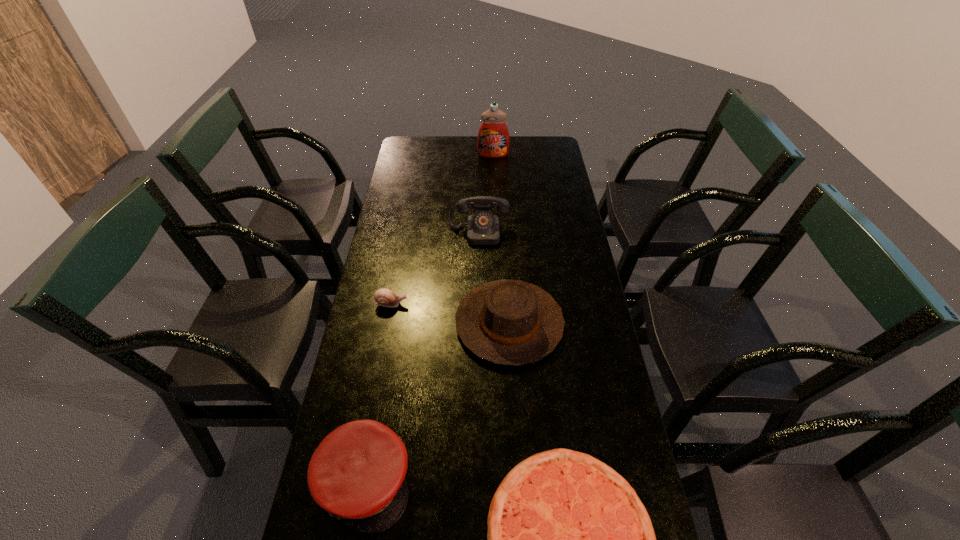
Where is `detergent`? The height and width of the screenshot is (540, 960). detergent is located at coordinates (493, 137).

The image size is (960, 540). I want to click on the farthest object, so click(x=493, y=137).

Find the location of a particular element. This screenshot has width=960, height=540. telephone is located at coordinates (483, 228).

I want to click on cowboy hat, so click(506, 322).

Image resolution: width=960 pixels, height=540 pixels. I want to click on cap, so click(x=357, y=472).

At what (x,y) coordinates should I click in order to perform the action: click on the fifth tallest object. Please return your answer as a coordinate pair (x, y). The height and width of the screenshot is (540, 960). Looking at the image, I should click on (384, 297).

Where is `vacant space located on the front surface of the detergent`? vacant space located on the front surface of the detergent is located at coordinates (495, 207).

This screenshot has height=540, width=960. Identify the location of blank area located on the dial of the second farthest object. (478, 302).

Locate an element on the screen. vacant area situated 0.360m on the front of the cowboy hat is located at coordinates (520, 510).

The height and width of the screenshot is (540, 960). Identify the location of free point located at the front of the cap where the visor is located. (537, 482).